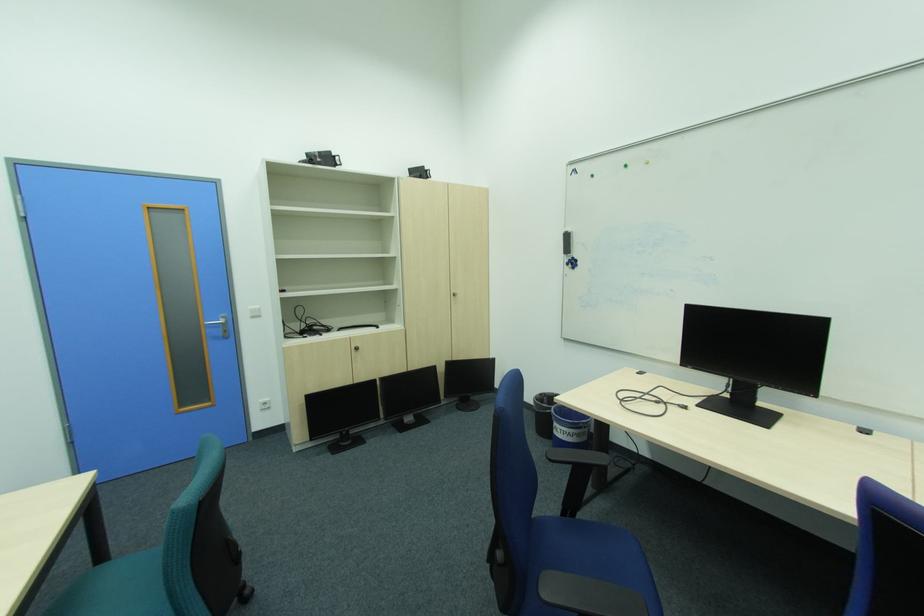
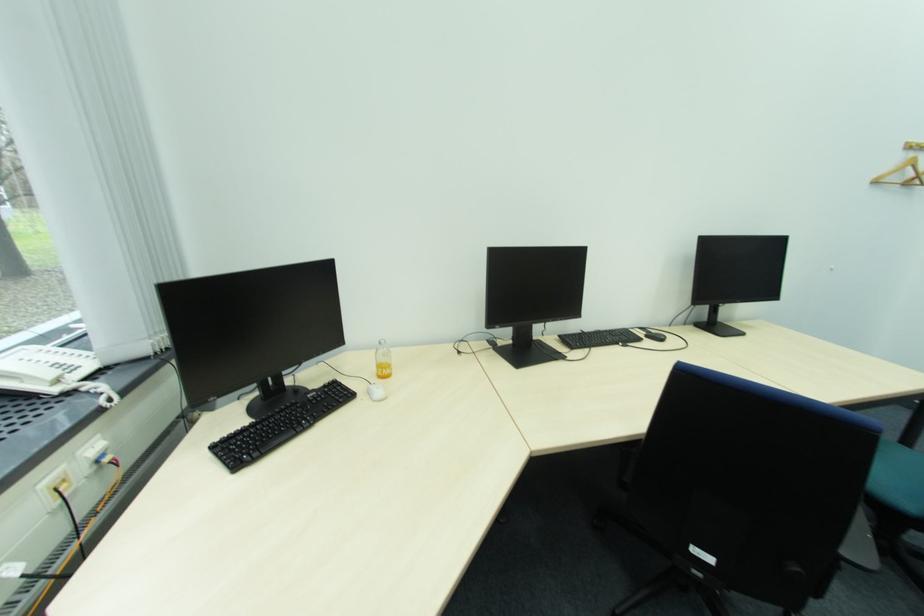
The images are taken continuously from a first-person perspective. In which direction is your viewpoint rotating?

The camera's rotation is toward left-down.